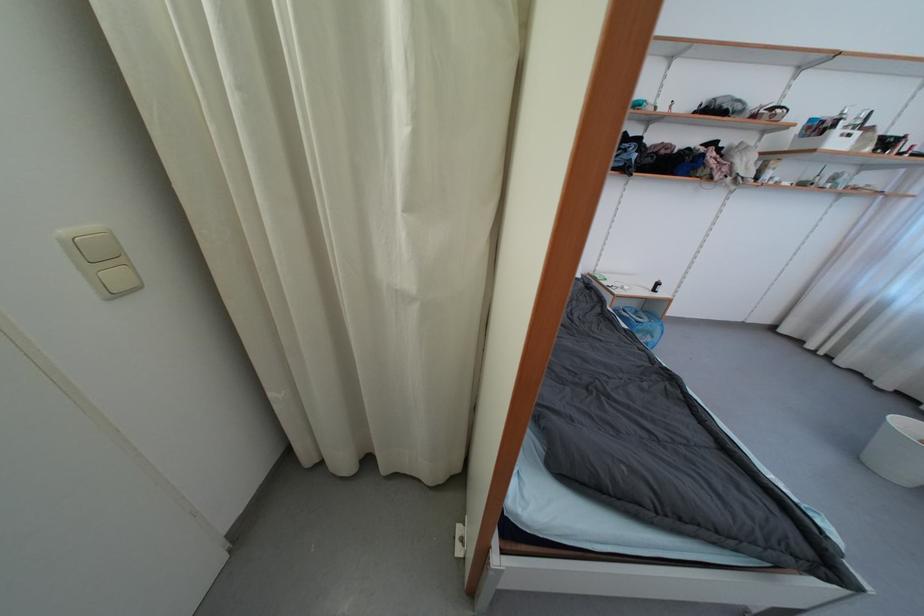
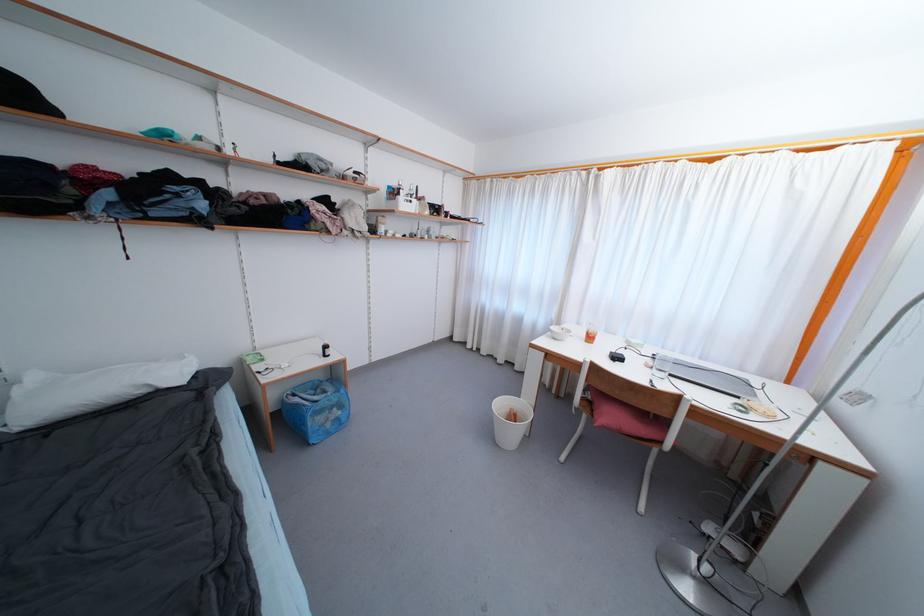
Find the pixel in the second image that matches the point at 628,314 in the first image.

(298, 398)